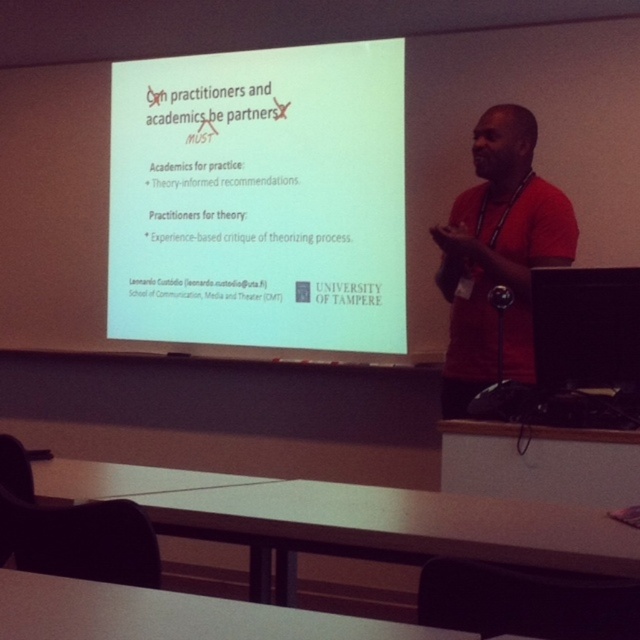
Between white matte projector screen at upper center and red matte shirt at right, which one has more height?

white matte projector screen at upper center is taller.

In the scene shown: Which is below, white matte projector screen at upper center or red matte shirt at right?

red matte shirt at right is below.

Is point (202, 129) farther from camera compared to point (449, 241)?

Yes, it is behind point (449, 241).

Where is `white matte projector screen at upper center`? white matte projector screen at upper center is located at coordinates (259, 198).